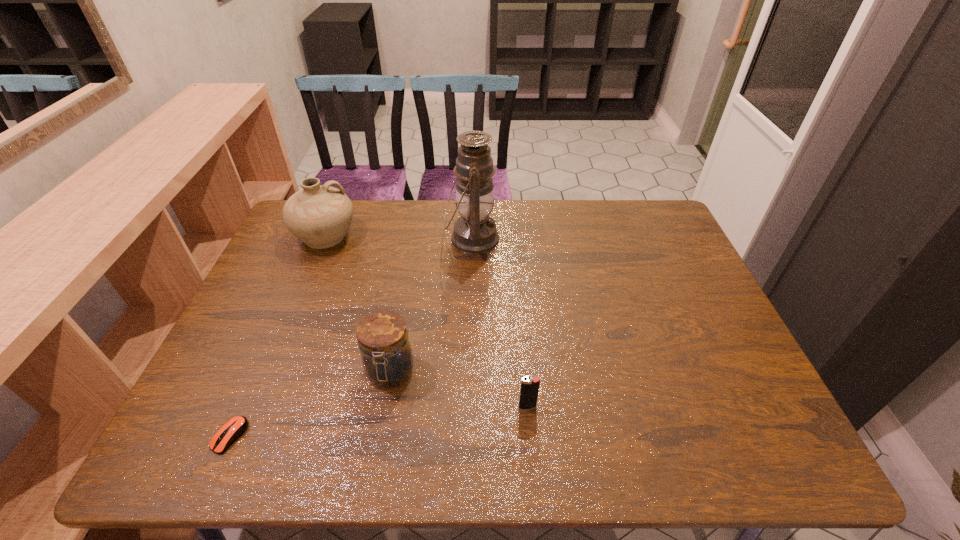
Locate an element on the screen. The image size is (960, 540). free space located on the front of the pottery is located at coordinates (300, 300).

The width and height of the screenshot is (960, 540). In order to click on blank area located on the lid of the third object from right to left in this screenshot , I will do `click(378, 438)`.

I want to click on vacant space located on the right of the second shortest object, so click(613, 407).

In order to click on blank space located on the back of the nearest object in this screenshot , I will do `click(277, 327)`.

This screenshot has width=960, height=540. What are the coordinates of `oil lamp present at the far edge` in the screenshot? It's located at (475, 232).

Where is `pottery at the far edge`? pottery at the far edge is located at coordinates (319, 215).

You are a GUI agent. You are given a task and a screenshot of the screen. Output one action in this format:
    pyautogui.click(x=<x>, y=<y>)
    Task: Click on the object that is at the near edge
    Image resolution: width=960 pixels, height=540 pixels.
    Given the screenshot: What is the action you would take?
    pyautogui.click(x=235, y=427)

Locate an element on the screen. pottery that is at the left edge is located at coordinates click(319, 215).

Locate an element on the screen. The image size is (960, 540). computer mouse positioned at the left edge is located at coordinates (235, 427).

Identify the location of object that is at the far left corner. This screenshot has height=540, width=960. (319, 215).